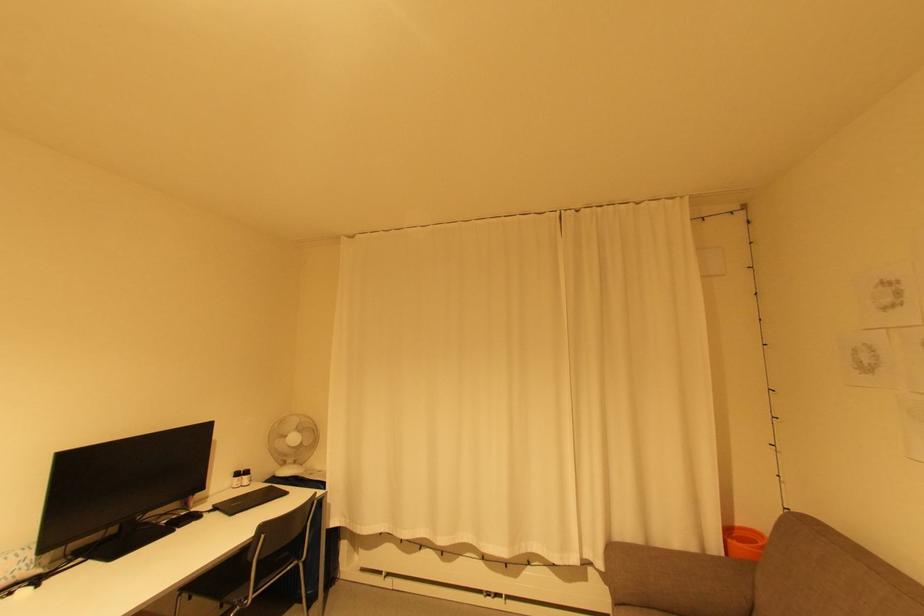
Where is `sofa sitting surface`? This screenshot has width=924, height=616. sofa sitting surface is located at coordinates (782, 600).